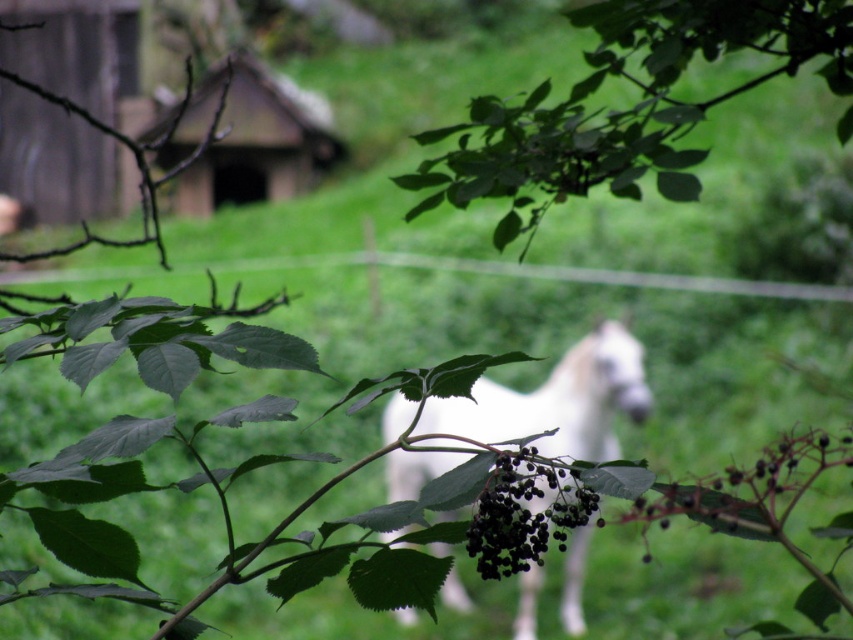
You are a photographer trying to capture the white glossy horse at center without any obstruction from the black matte berries at center. Based on the scene, can you position yourself in a way to ensure the berries are not blocking the horse in the photo?

The white glossy horse at center is positioned under the black matte berries at center, so moving to a slightly lower angle or shifting your position to the side would allow you to frame the shot so the berries are no longer blocking the horse.

You are a photographer trying to capture a clear shot of the black matte berries at center without the white glossy horse at center blocking it. Based on their positions, which direction should you move your camera to the left or right to achieve this?

Since the white glossy horse at center is to the right of the black matte berries at center, moving your camera to the left would shift the frame away from the horse and towards the berries, allowing you to capture the black matte berries at center without obstruction.

You are an artist sketching this scene. You want to draw the green leafy branch at upper center and the wooden hut at upper center. Which one should you draw first if you follow the rule of drawing thinner objects before thicker ones?

The green leafy branch at upper center is thinner than the wooden hut at upper center, so you should draw the green leafy branch at upper center first.